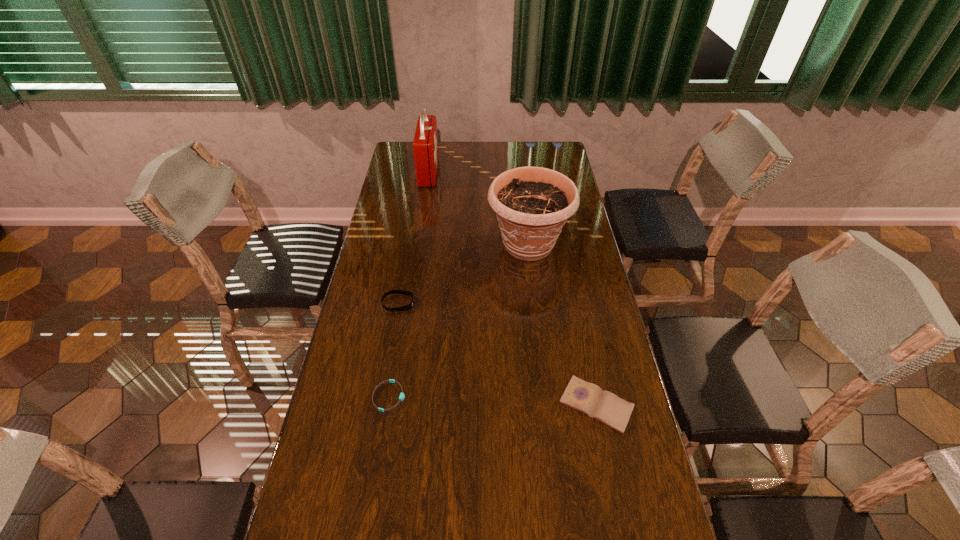
I want to click on free space in the image that satisfies the following two spatial constraints: 1. on the display of the diary; 2. on the left side of the third nearest object, so click(381, 404).

At what (x,y) coordinates should I click in order to perform the action: click on vacant space that satisfies the following two spatial constraints: 1. on the back side of the flowerpot; 2. on the front face of the farthest object. Please return your answer as a coordinate pair (x, y). Looking at the image, I should click on (519, 172).